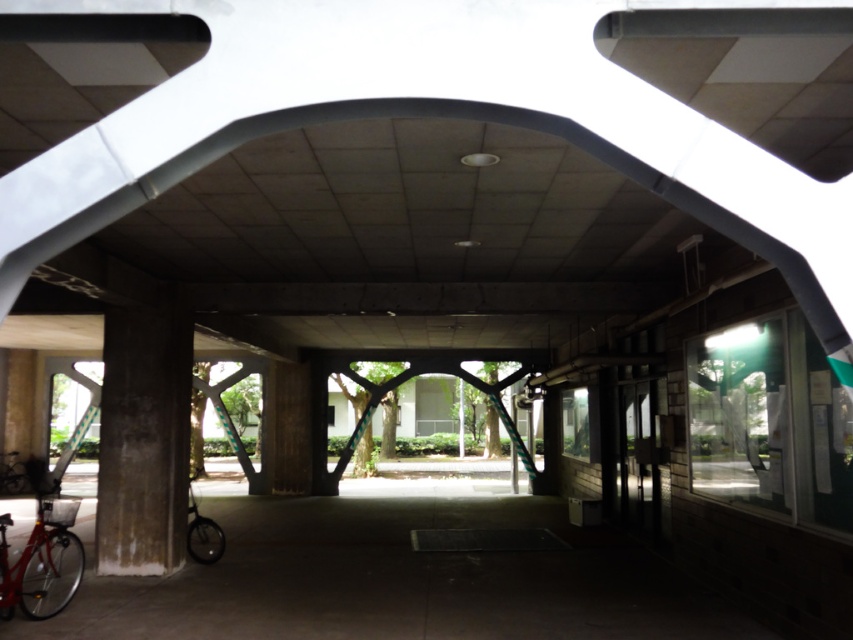
Question: Is shiny black bicycle at lower left smaller than matte red bicycle at lower left?

Choices:
 (A) no
 (B) yes

Answer: (B)

Question: Considering the real-world distances, which object is farthest from the shiny red bicycle at lower left?

Choices:
 (A) shiny black bicycle at lower left
 (B) matte red bicycle at lower left

Answer: (B)

Question: Considering the real-world distances, which object is farthest from the matte red bicycle at lower left?

Choices:
 (A) shiny red bicycle at lower left
 (B) shiny black bicycle at lower left

Answer: (A)

Question: From the image, what is the correct spatial relationship of shiny black bicycle at lower left in relation to matte red bicycle at lower left?

Choices:
 (A) above
 (B) below

Answer: (A)

Question: Estimate the real-world distances between objects in this image. Which object is farther from the matte red bicycle at lower left?

Choices:
 (A) shiny red bicycle at lower left
 (B) shiny black bicycle at lower left

Answer: (A)

Question: Is shiny black bicycle at lower left to the left of matte red bicycle at lower left from the viewer's perspective?

Choices:
 (A) yes
 (B) no

Answer: (B)